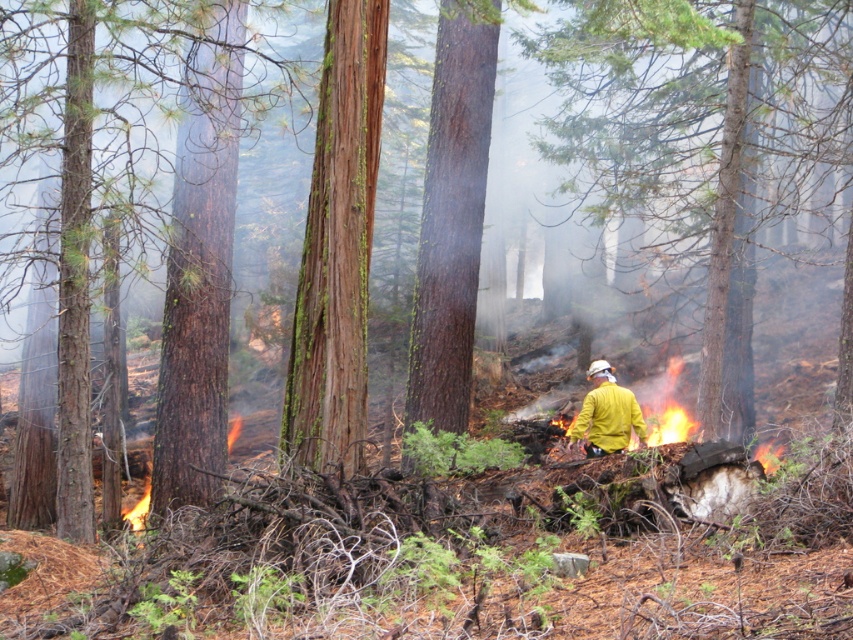
Is green mossy bark tree at center positioned behind flame wood fire at lower left?

No, it is in front of flame wood fire at lower left.

Does green mossy bark tree at center appear on the left side of flame wood fire at lower left?

No, green mossy bark tree at center is not to the left of flame wood fire at lower left.

Does point (297, 380) come farther from viewer compared to point (229, 440)?

No.

Locate an element on the screen. The image size is (853, 640). green mossy bark tree at center is located at coordinates (337, 248).

Which of these two, yellow matte jacket at center or flame wood fire at lower left, stands taller?

With more height is flame wood fire at lower left.

Between yellow matte jacket at center and flame wood fire at lower left, which one is positioned lower?

flame wood fire at lower left is below.

Is point (642, 429) behind point (231, 442)?

No, it is not.

This screenshot has height=640, width=853. Identify the location of yellow matte jacket at center. (606, 413).

Describe the element at coordinates (705, 140) in the screenshot. Image resolution: width=853 pixels, height=640 pixels. I see `smooth bark tree at center` at that location.

Who is more forward, (601, 42) or (329, 435)?

Point (329, 435) is more forward.

I want to click on smooth bark tree at center, so click(x=705, y=140).